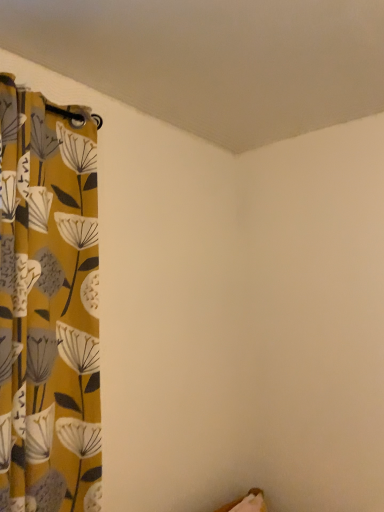
Measure the distance between yellow floral fabric curtain at left and camera.

A distance of 39.26 inches exists between yellow floral fabric curtain at left and camera.

Looking at this image, what is the approximate width of yellow floral fabric curtain at left?

yellow floral fabric curtain at left is 4.96 inches wide.

Locate an element on the screen. The image size is (384, 512). yellow floral fabric curtain at left is located at coordinates (49, 306).

The height and width of the screenshot is (512, 384). What do you see at coordinates (49, 306) in the screenshot? I see `yellow floral fabric curtain at left` at bounding box center [49, 306].

The height and width of the screenshot is (512, 384). What are the coordinates of `yellow floral fabric curtain at left` in the screenshot? It's located at pyautogui.click(x=49, y=306).